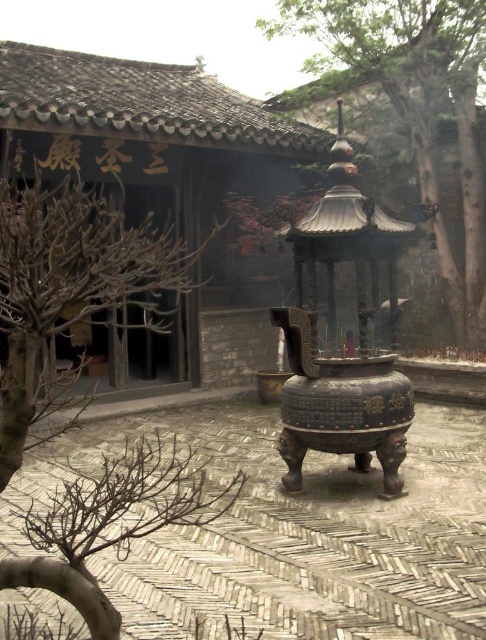
You are an artist sketching the courtyard scene. You need to decide which object to draw first based on their sizes. Which one should you start with, the bare branches at upper left or the green textured tree at upper center?

The green textured tree at upper center is larger than the bare branches at upper left, so you should start with the green textured tree at upper center to ensure proper scaling in your sketch.

You are standing in the courtyard and want to touch the bare branches at upper left. Considering your arm can reach 0.8 meters, can you reach them without moving closer?

The bare branches at upper left are 1.36 meters away from you, which is farther than your arm can reach. You need to move closer to touch them.